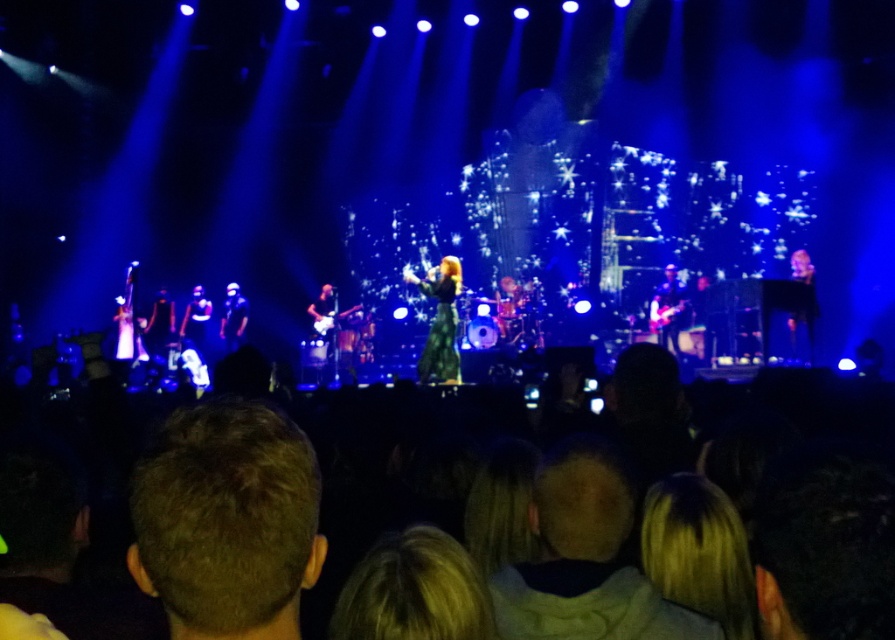
Is shiny black guitar at center bigger than shiny black jacket at center?

Incorrect, shiny black guitar at center is not larger than shiny black jacket at center.

Is shiny black guitar at center taller than shiny black jacket at center?

No.

Who is more forward, (686, 307) or (179, 330)?

Positioned in front is point (686, 307).

Locate an element on the screen. The image size is (895, 640). shiny black guitar at center is located at coordinates (668, 308).

Is point (433, 332) closer to viewer compared to point (201, 353)?

That is True.

Which of these two, green textured dress at center or shiny black jacket at center, stands shorter?

shiny black jacket at center

Who is more forward, (424, 280) or (194, 308)?

Point (424, 280)

Locate an element on the screen. The image size is (895, 640). green textured dress at center is located at coordinates (440, 321).

Can you confirm if green textured dress at center is thinner than shiny black guitar at center?

No, green textured dress at center is not thinner than shiny black guitar at center.

Does point (422, 368) come in front of point (669, 321)?

Yes.

Who is more distant from viewer, (x=449, y=305) or (x=672, y=330)?

The point (x=672, y=330) is behind.

Where is `green textured dress at center`? This screenshot has height=640, width=895. green textured dress at center is located at coordinates (440, 321).